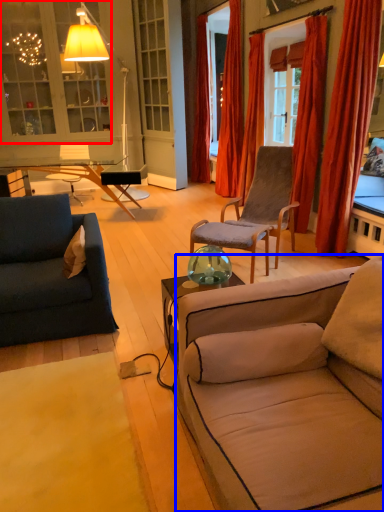
Question: Which object is closer to the camera taking this photo, cabinetry (highlighted by a red box) or studio couch (highlighted by a blue box)?

Choices:
 (A) cabinetry
 (B) studio couch

Answer: (B)